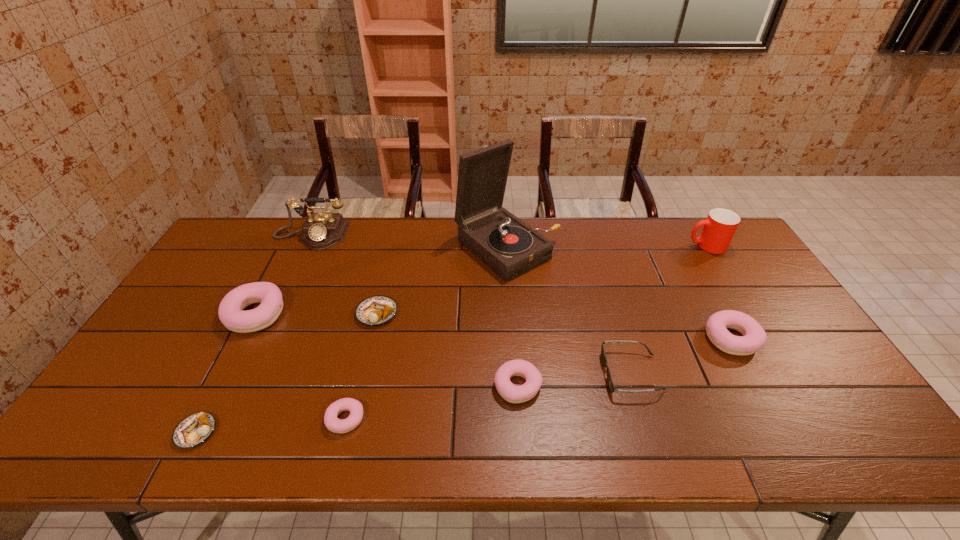
The image size is (960, 540). I want to click on vacant region located on the side of the third tallest object with the handle, so click(591, 246).

Find the location of a particular element. The image size is (960, 540). free space located on the side of the third tallest object with the handle is located at coordinates (609, 246).

I want to click on free space located on the side of the third tallest object with the handle, so click(x=659, y=246).

Identify the location of free space located on the back of the leftmost pink pastry. point(287,252).

You are a GUI agent. You are given a task and a screenshot of the screen. Output one action in this format:
    pyautogui.click(x=<x>, y=<y>)
    Task: Click on the vacant space located 0.210m on the back of the second tallest pastry
    The height and width of the screenshot is (540, 960).
    Given the screenshot: What is the action you would take?
    pyautogui.click(x=695, y=272)

Find the location of a particular element. The width and height of the screenshot is (960, 540). vacant space situated 0.360m on the back of the second pastry from right to left is located at coordinates (510, 275).

The height and width of the screenshot is (540, 960). In order to click on free space located on the right of the farther brown pastry in this screenshot , I will do `click(435, 313)`.

You are a GUI agent. You are given a task and a screenshot of the screen. Output one action in this format:
    pyautogui.click(x=<x>, y=<y>)
    Task: Click on the vacant space situated on the front-facing side of the third object from right to left
    
    Given the screenshot: What is the action you would take?
    pyautogui.click(x=549, y=373)

In order to click on vacant space located on the front-facing side of the third object from right to left in this screenshot , I will do `click(456, 373)`.

Locate an element on the screen. vacant space located 0.400m on the front-facing side of the third object from right to left is located at coordinates (448, 373).